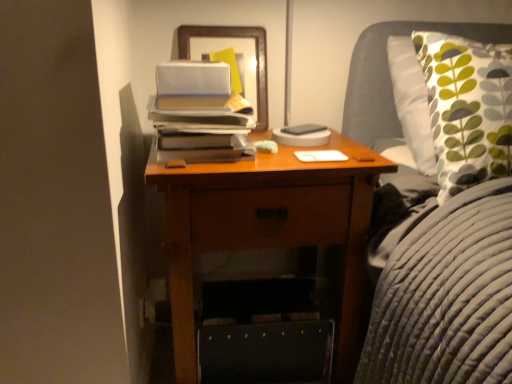
Question: In the image, is hardcover book at center on the left side or the right side of wooden nightstand at center?

Choices:
 (A) right
 (B) left

Answer: (A)

Question: Considering the positions of hardcover book at center and wooden nightstand at center in the image, is hardcover book at center taller or shorter than wooden nightstand at center?

Choices:
 (A) short
 (B) tall

Answer: (A)

Question: Based on their relative distances, which object is farther from the wooden picture frame at upper center?

Choices:
 (A) hardcover book at center
 (B) wooden nightstand at center

Answer: (B)

Question: Which of these objects is positioned farthest from the wooden picture frame at upper center?

Choices:
 (A) wooden nightstand at center
 (B) hardcover book at center

Answer: (A)